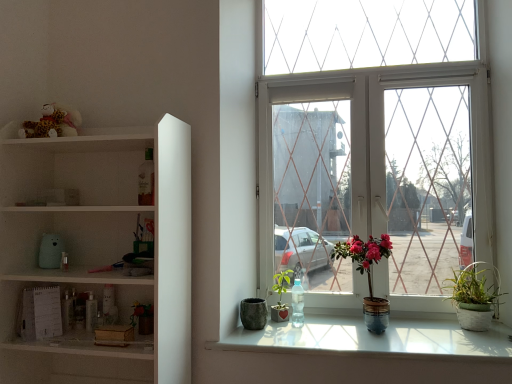
This screenshot has height=384, width=512. Describe the element at coordinates (97, 250) in the screenshot. I see `white matte shelf at left` at that location.

Locate an element on the screen. matte ceramic pot at center, the 2th houseplant when ordered from right to left is located at coordinates (368, 275).

Measure the distance between point (424, 321) and camera.

7.37 feet.

This screenshot has height=384, width=512. What do you see at coordinates (253, 313) in the screenshot?
I see `matte gray stone pot at lower center` at bounding box center [253, 313].

I want to click on transparent plastic bottle at window, so click(297, 304).

Is matte ceramic pot at center, which appears as the 3th houseplant when viewed from the left, aimed at matte gray stone pot at lower center?

No, matte ceramic pot at center, which appears as the 3th houseplant when viewed from the left, is not oriented towards matte gray stone pot at lower center.

Locate an element on the screen. The image size is (512, 384). the 2nd houseplant to the right when counting from the matte gray stone pot at lower center is located at coordinates (368, 275).

Who is taller, matte ceramic pot at center, the 2th houseplant when ordered from right to left, or matte gray stone pot at lower center?

With more height is matte ceramic pot at center, the 2th houseplant when ordered from right to left.

Is clear glass window at center wider or thinner than matte ceramic pot at center, the 2th houseplant when ordered from right to left?

In the image, clear glass window at center appears to be more narrow than matte ceramic pot at center, the 2th houseplant when ordered from right to left.

Is clear glass window at center located outside matte ceramic pot at center, which appears as the 3th houseplant when viewed from the left?

Indeed, clear glass window at center is completely outside matte ceramic pot at center, which appears as the 3th houseplant when viewed from the left.

Could you tell me if clear glass window at center is turned towards matte ceramic pot at center, the 2th houseplant when ordered from right to left?

Yes, clear glass window at center is turned towards matte ceramic pot at center, the 2th houseplant when ordered from right to left.

Is clear glass window at center smaller than matte ceramic pot at center, the 2th houseplant when ordered from right to left?

No.

Does transparent plastic bottle at window have a lesser width compared to matte gray stone pot at lower center?

Yes.

Which is in front, point (297, 293) or point (260, 327)?

The point (260, 327) is more forward.

Which of these two, transparent plastic bottle at window or matte gray stone pot at lower center, stands shorter?

matte gray stone pot at lower center.

Which object is positioned more to the right, white woven basket at lower right, which is the 4th houseplant from left to right, or green matte plant at center, which is the 3th houseplant in right-to-left order?

Positioned to the right is white woven basket at lower right, which is the 4th houseplant from left to right.

Considering the relative sizes of white woven basket at lower right, which is the 4th houseplant from left to right, and green matte plant at center, arranged as the 2th houseplant when viewed from the left, in the image provided, is white woven basket at lower right, which is the 4th houseplant from left to right, wider than green matte plant at center, arranged as the 2th houseplant when viewed from the left,?

Yes, white woven basket at lower right, which is the 4th houseplant from left to right, is wider than green matte plant at center, arranged as the 2th houseplant when viewed from the left.

Between white woven basket at lower right, placed as the first houseplant when sorted from right to left, and green matte plant at center, arranged as the 2th houseplant when viewed from the left, which one has more height?

white woven basket at lower right, placed as the first houseplant when sorted from right to left, is taller.

Does white woven basket at lower right, placed as the first houseplant when sorted from right to left, touch green matte plant at center, arranged as the 2th houseplant when viewed from the left?

No, white woven basket at lower right, placed as the first houseplant when sorted from right to left, is not touching green matte plant at center, arranged as the 2th houseplant when viewed from the left.

You are a GUI agent. You are given a task and a screenshot of the screen. Output one action in this format:
    pyautogui.click(x=<x>, y=<y>)
    Task: Click on the houseplant lying in front of the matte ceramic pot at center, which appears as the 3th houseplant when viewed from the left
    The width and height of the screenshot is (512, 384).
    Given the screenshot: What is the action you would take?
    pyautogui.click(x=143, y=317)

In the scene shown: Is matte ceramic pot at center, the 2th houseplant when ordered from right to left, closer to the viewer compared to green matte plant at lower left, the 1th houseplant positioned from the left?

No, it is behind green matte plant at lower left, the 1th houseplant positioned from the left.

Can you confirm if matte ceramic pot at center, which appears as the 3th houseplant when viewed from the left, is bigger than green matte plant at lower left, placed as the fourth houseplant when sorted from right to left?

Yes, matte ceramic pot at center, which appears as the 3th houseplant when viewed from the left, is bigger than green matte plant at lower left, placed as the fourth houseplant when sorted from right to left.

Considering the relative positions of clear glass window at center and fluffy plush teddy bear at upper left in the image provided, is clear glass window at center to the left of fluffy plush teddy bear at upper left from the viewer's perspective?

No, clear glass window at center is not to the left of fluffy plush teddy bear at upper left.

Is clear glass window at center wider or thinner than fluffy plush teddy bear at upper left?

clear glass window at center is wider than fluffy plush teddy bear at upper left.

Is clear glass window at center beside fluffy plush teddy bear at upper left?

No, clear glass window at center is not with fluffy plush teddy bear at upper left.

Does clear glass window at center have a greater height compared to fluffy plush teddy bear at upper left?

Correct, clear glass window at center is much taller as fluffy plush teddy bear at upper left.

Which of these two, green matte plant at center, which is the 3th houseplant in right-to-left order, or transparent plastic bottle at window, is thinner?

With smaller width is transparent plastic bottle at window.

Between point (283, 309) and point (297, 322), which one is positioned behind?

The point (283, 309) is behind.

Which object is positioned more to the right, green matte plant at center, arranged as the 2th houseplant when viewed from the left, or transparent plastic bottle at window?

Positioned to the right is transparent plastic bottle at window.

Does green matte plant at center, which is the 3th houseplant in right-to-left order, have a smaller size compared to transparent plastic bottle at window?

No, green matte plant at center, which is the 3th houseplant in right-to-left order, is not smaller than transparent plastic bottle at window.

I want to click on flowerpot below the matte ceramic pot at center, which appears as the 3th houseplant when viewed from the left (from a real-world perspective), so click(253, 313).

From the clear glass window at center, count the 1st houseplant to the left and point to it. Please provide its 2D coordinates.

[(368, 275)]

Which object lies nearer to the anchor point green matte plant at lower left, placed as the fourth houseplant when sorted from right to left, white woven basket at lower right, which is the 4th houseplant from left to right, or white matte shelf at left?

white matte shelf at left is closer to green matte plant at lower left, placed as the fourth houseplant when sorted from right to left.

Estimate the real-world distances between objects in this image. Which object is further from fluffy plush teddy bear at upper left, white glossy window sill at lower center or matte ceramic pot at center, which appears as the 3th houseplant when viewed from the left?

Based on the image, matte ceramic pot at center, which appears as the 3th houseplant when viewed from the left, appears to be further to fluffy plush teddy bear at upper left.

Which object lies nearer to the anchor point fluffy plush teddy bear at upper left, clear glass window at center or white matte shelf at left?

white matte shelf at left is positioned closer to the anchor fluffy plush teddy bear at upper left.

Looking at the image, which one is located further to white woven basket at lower right, placed as the first houseplant when sorted from right to left, matte gray stone pot at lower center or matte ceramic pot at center, which appears as the 3th houseplant when viewed from the left?

Based on the image, matte gray stone pot at lower center appears to be further to white woven basket at lower right, placed as the first houseplant when sorted from right to left.

When comparing their distances from white woven basket at lower right, which is the 4th houseplant from left to right, does matte gray stone pot at lower center or fluffy plush teddy bear at upper left seem further?

fluffy plush teddy bear at upper left is further to white woven basket at lower right, which is the 4th houseplant from left to right.

Based on their spatial positions, is white woven basket at lower right, placed as the first houseplant when sorted from right to left, or white glossy window sill at lower center further from matte ceramic pot at center, which appears as the 3th houseplant when viewed from the left?

white woven basket at lower right, placed as the first houseplant when sorted from right to left, is further to matte ceramic pot at center, which appears as the 3th houseplant when viewed from the left.

When comparing their distances from clear glass window at center, does fluffy plush teddy bear at upper left or white matte shelf at left seem closer?

white matte shelf at left.

Based on the photo, which object lies further to the anchor point green matte plant at lower left, the 1th houseplant positioned from the left, white woven basket at lower right, placed as the first houseplant when sorted from right to left, or clear glass window at center?

white woven basket at lower right, placed as the first houseplant when sorted from right to left, is positioned further to the anchor green matte plant at lower left, the 1th houseplant positioned from the left.

You are a GUI agent. You are given a task and a screenshot of the screen. Output one action in this format:
    pyautogui.click(x=<x>, y=<y>)
    Task: Click on the shelf located between fluffy plush teddy bear at upper left and green matte plant at center, which is the 3th houseplant in right-to-left order, in the left-right direction
    This screenshot has width=512, height=384.
    Given the screenshot: What is the action you would take?
    pyautogui.click(x=97, y=250)

This screenshot has height=384, width=512. Find the location of `shelf between fluffy plush teddy bear at upper left and transparent plastic bottle at window in the horizontal direction`. shelf between fluffy plush teddy bear at upper left and transparent plastic bottle at window in the horizontal direction is located at coordinates (97, 250).

Identify the location of window sill between green matte plant at lower left, placed as the fourth houseplant when sorted from right to left, and clear glass window at center from left to right. The width and height of the screenshot is (512, 384). (373, 339).

Identify the location of houseplant located between transparent plastic bottle at window and white woven basket at lower right, placed as the first houseplant when sorted from right to left, in the left-right direction. (368, 275).